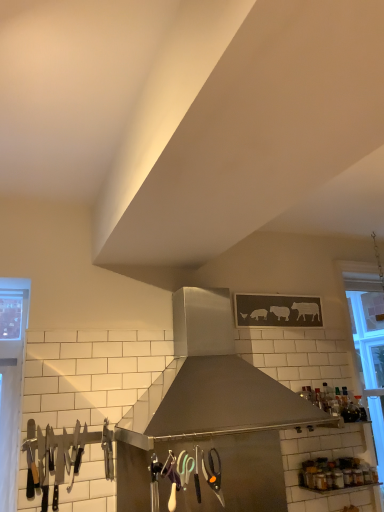
Question: From the image's perspective, is polished stainless steel knives at left positioned above or below clear glass window at right?

Choices:
 (A) above
 (B) below

Answer: (B)

Question: Looking at their shapes, would you say polished stainless steel knives at left is wider or thinner than clear glass window at right?

Choices:
 (A) thin
 (B) wide

Answer: (A)

Question: Estimate the real-world distances between objects in this image. Which object is closer to the clear glass window at right?

Choices:
 (A) stainless steel range hood at center
 (B) polished stainless steel knives at left
 (C) transparent glass bottle at upper right

Answer: (C)

Question: Estimate the real-world distances between objects in this image. Which object is closer to the polished stainless steel knives at left?

Choices:
 (A) transparent glass bottle at upper right
 (B) stainless steel range hood at center
 (C) clear glass window at right

Answer: (B)